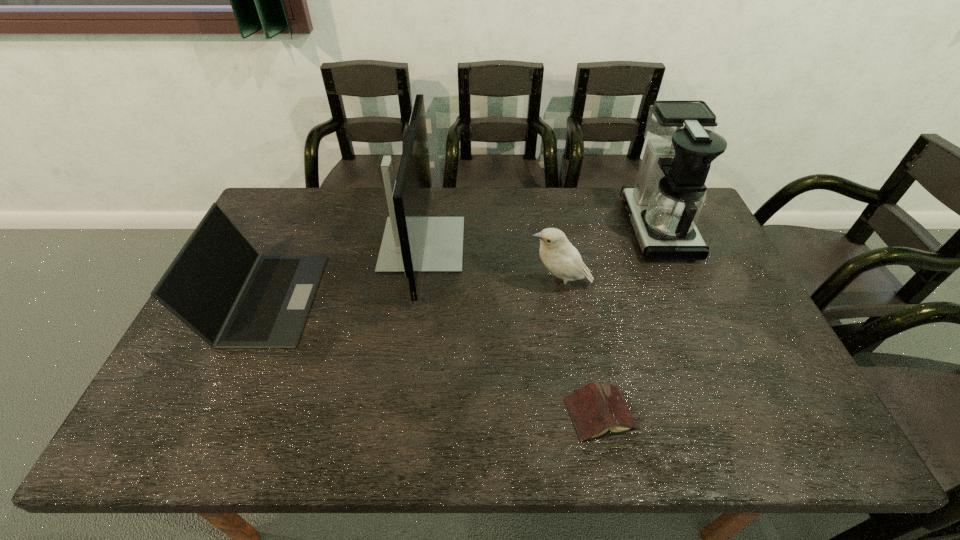
In order to click on vacant point located at the beak of the bird in this screenshot , I will do `click(399, 286)`.

Locate an element on the screen. Image resolution: width=960 pixels, height=540 pixels. free spot located 0.240m at the beak of the bird is located at coordinates (444, 286).

Find the location of `free space located at the beak of the bird`. free space located at the beak of the bird is located at coordinates click(478, 286).

At what (x,y) coordinates should I click in order to perform the action: click on vacant area situated 0.360m on the screen of the laptop. Please return your answer as a coordinate pair (x, y). The height and width of the screenshot is (540, 960). Looking at the image, I should click on (442, 298).

Locate an element on the screen. blank area located on the right of the shortest object is located at coordinates (704, 414).

Where is `computer monitor located in the far edge section of the desktop`? computer monitor located in the far edge section of the desktop is located at coordinates (413, 242).

Locate an element on the screen. This screenshot has height=540, width=960. coffee maker present at the far edge is located at coordinates (664, 205).

What are the coordinates of `object at the near edge` in the screenshot? It's located at (596, 408).

Locate an element on the screen. object positioned at the left edge is located at coordinates (218, 285).

Where is `object at the right edge`? object at the right edge is located at coordinates (664, 205).